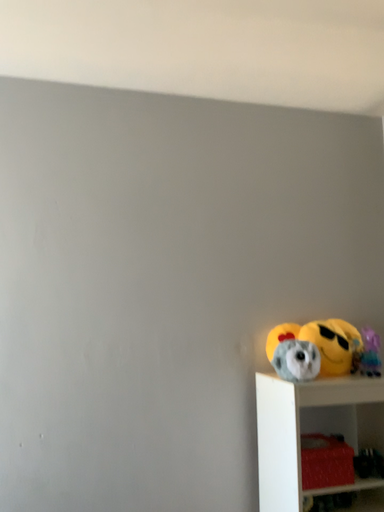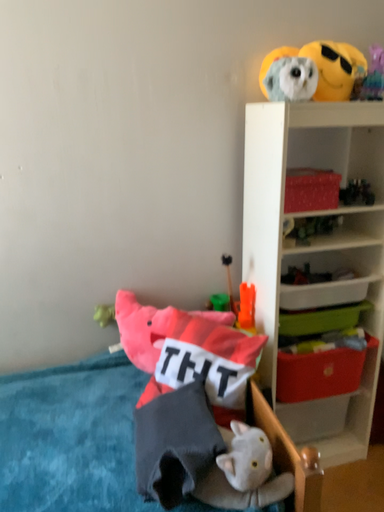
Question: Which way did the camera rotate in the video?

Choices:
 (A) rotated upward
 (B) rotated downward

Answer: (B)